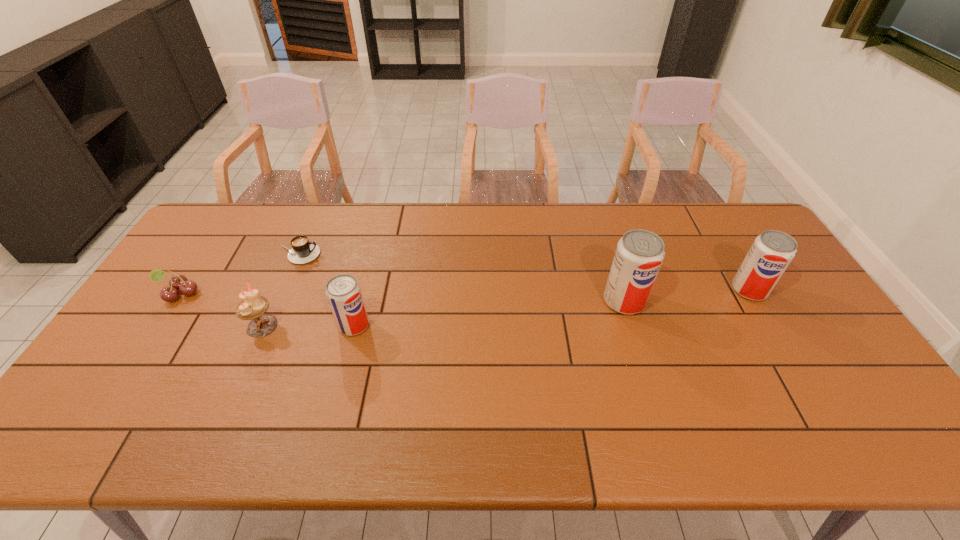
To make them evenly spaced by inserting another pop_(soda) among them, please locate a vacant spot for this new pop_(soda). Please provide its 2D coordinates. Your answer should be formatted as a tuple, i.e. [(x, y)], where the tuple contains the x and y coordinates of a point satisfying the conditions above.

[(492, 313)]